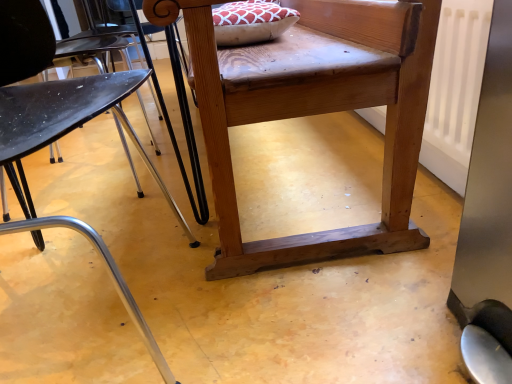
Question: Is point (355, 107) closer or farther from the camera than point (72, 81)?

Choices:
 (A) closer
 (B) farther

Answer: (B)

Question: From the image's perspective, is natural wood chair at center located above or below metallic black chair at left?

Choices:
 (A) above
 (B) below

Answer: (A)

Question: Is natural wood chair at center bigger or smaller than metallic black chair at left?

Choices:
 (A) big
 (B) small

Answer: (A)

Question: From the image's perspective, relative to natural wood chair at center, is metallic black chair at left above or below?

Choices:
 (A) below
 (B) above

Answer: (A)

Question: In the image, is metallic black chair at left on the left side or the right side of natural wood chair at center?

Choices:
 (A) right
 (B) left

Answer: (B)

Question: Looking at the image, does metallic black chair at left seem bigger or smaller compared to natural wood chair at center?

Choices:
 (A) small
 (B) big

Answer: (A)

Question: From a real-world perspective, relative to natural wood chair at center, is metallic black chair at left vertically above or below?

Choices:
 (A) above
 (B) below

Answer: (A)